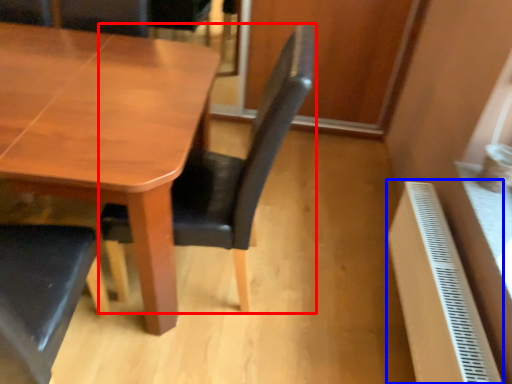
Question: Among these objects, which one is farthest to the camera, chair (highlighted by a red box) or radiator (highlighted by a blue box)?

Choices:
 (A) chair
 (B) radiator

Answer: (B)